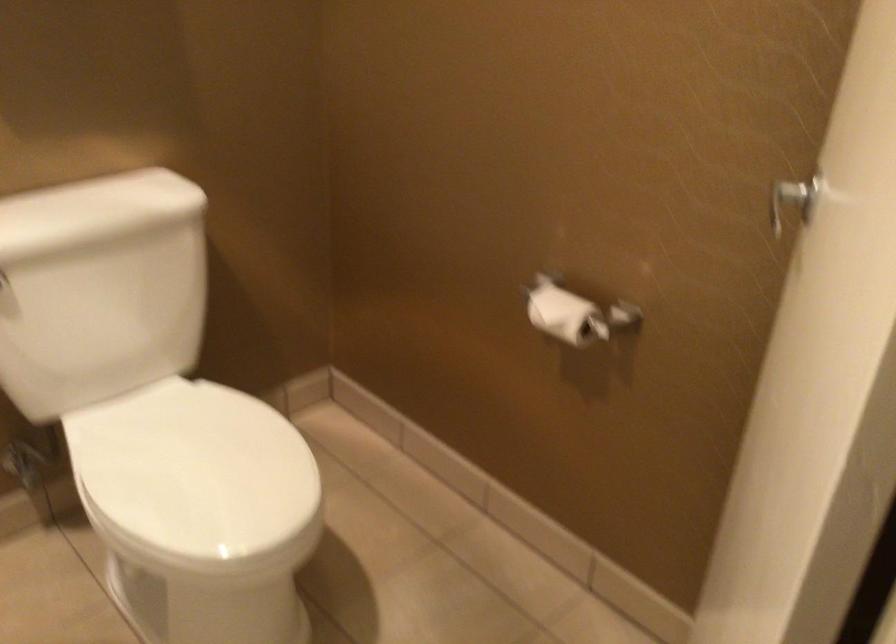
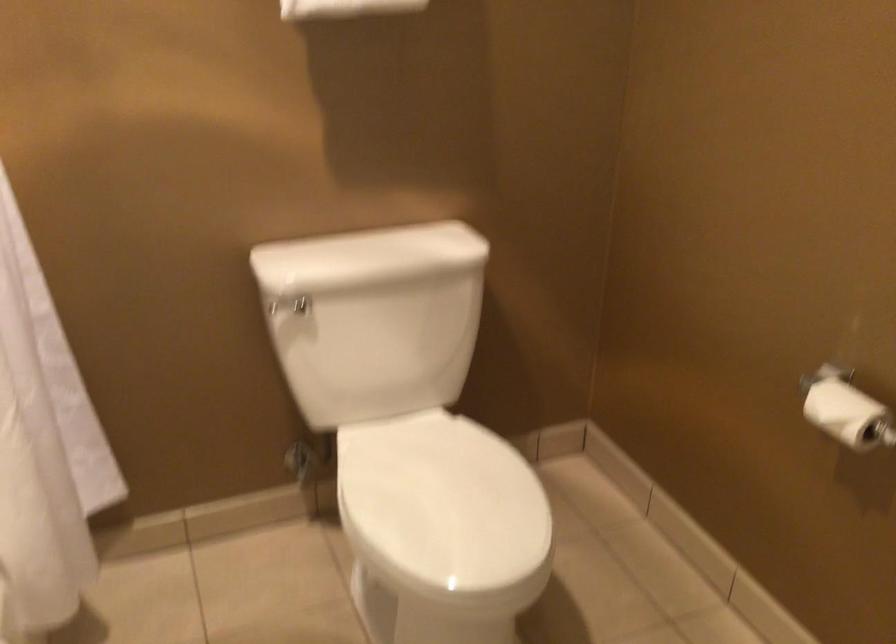
Question: What movement of the cameraman would produce the second image?

Choices:
 (A) Left
 (B) Right
 (C) Forward
 (D) Backward

Answer: (B)